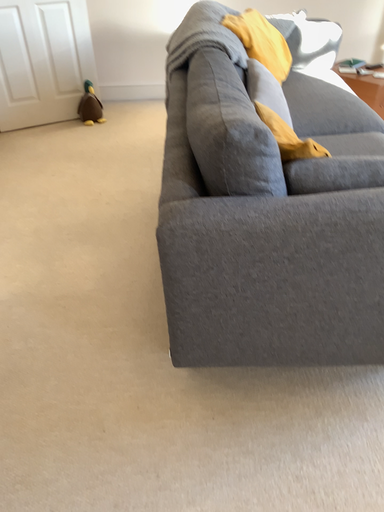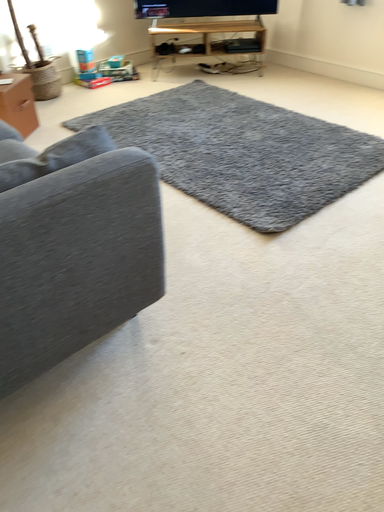
Question: Which way did the camera rotate in the video?

Choices:
 (A) rotated right
 (B) rotated left

Answer: (A)